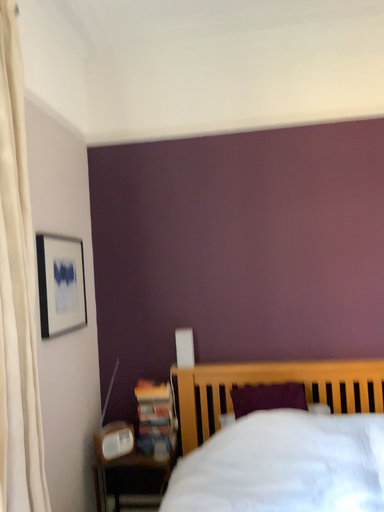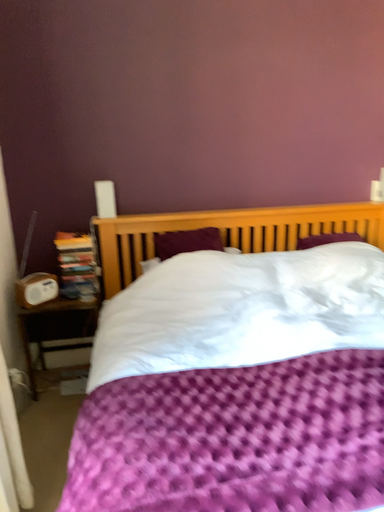
Question: Which way did the camera rotate in the video?

Choices:
 (A) rotated downward
 (B) rotated upward

Answer: (A)